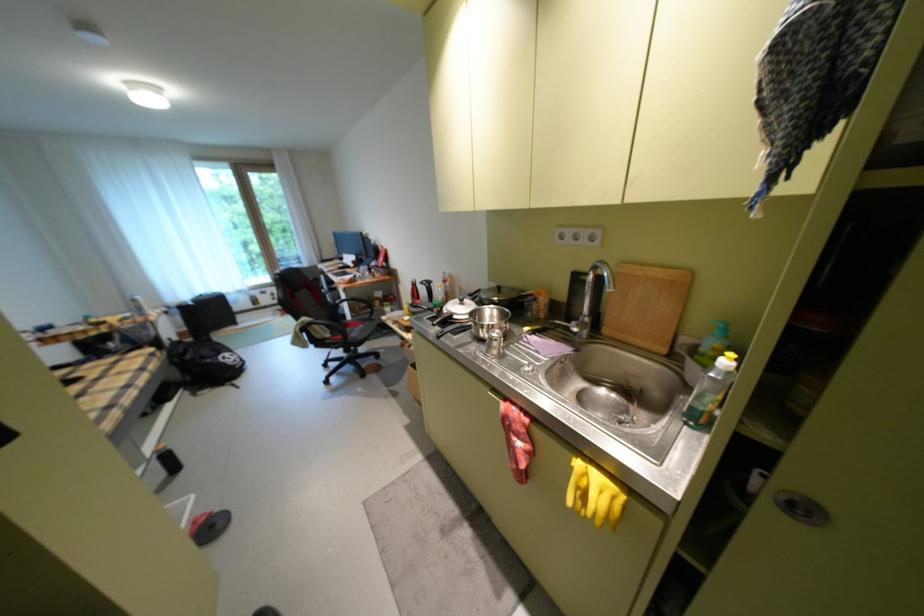
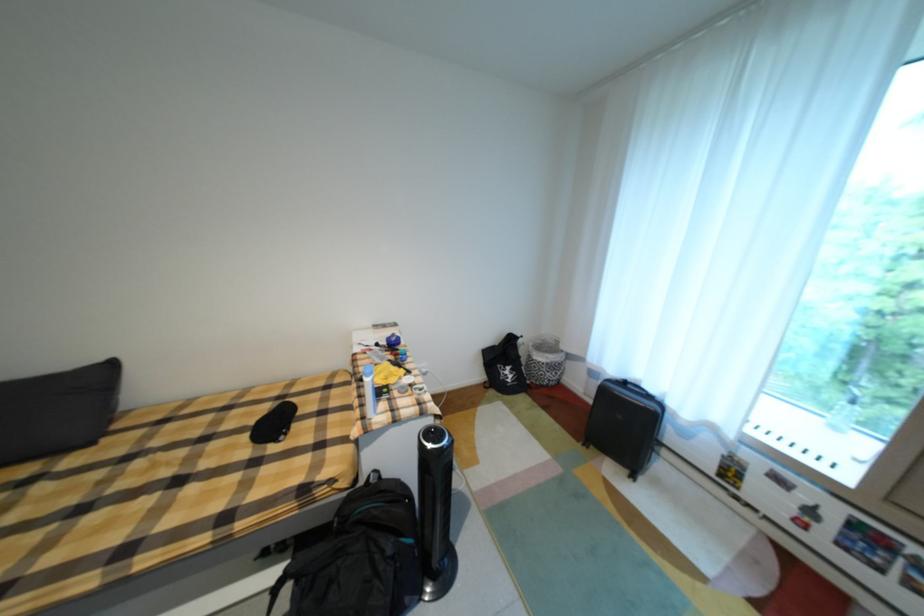
The point at (197,352) is marked in the first image. Where is the corresponding point in the second image?

(370, 525)